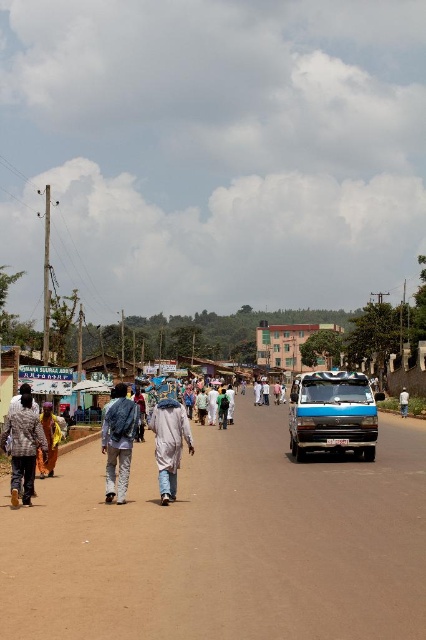
You are a fashion designer observing the street scene. You notice two people wearing the denim jacket at center and the plaid fabric shirt at lower left. Which clothing item is larger in size?

The denim jacket at center is bigger than the plaid fabric shirt at lower left.

You are a photographer standing on the street and want to take a photo of the white cotton shirt at center without the plaid fabric shirt at lower left blocking it. What should you do?

The plaid fabric shirt at lower left is in front of the white cotton shirt at center, so you should move to the side or adjust your angle to avoid the plaid fabric shirt at lower left blocking the view of the white cotton shirt at center.

You are a delivery person standing next to the blue metallic van at center. You need to hand a package to someone wearing the plaid fabric shirt at lower left. Can you reach them without moving from your current position if the maximum reaching distance is 25 feet?

The blue metallic van at center is 26.47 feet away from the plaid fabric shirt at lower left. Since the maximum reaching distance is 25 feet, you cannot reach them without moving from your current position.